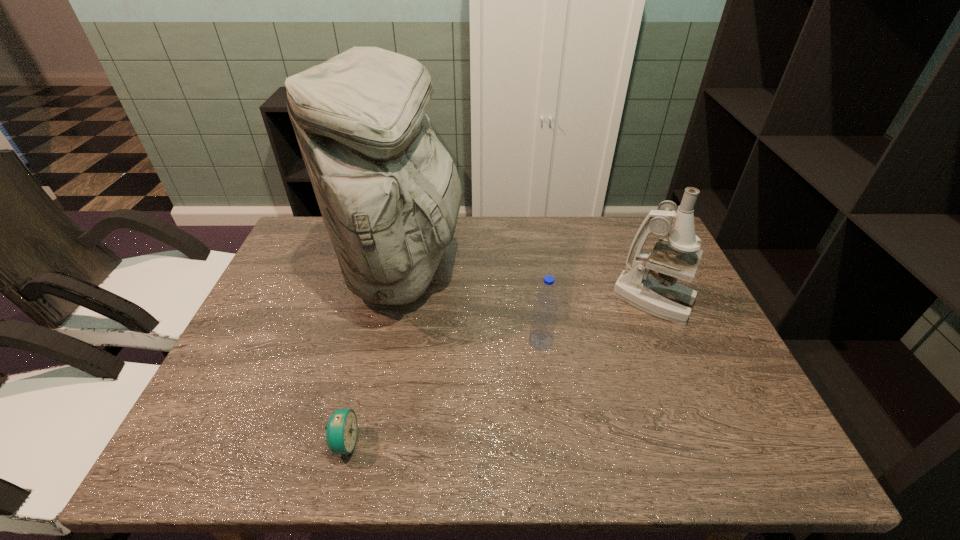
Find the location of a particular element. the second closest object to the backpack is located at coordinates (341, 431).

Where is `free spot that satisfies the following two spatial constraints: 1. on the front-facing side of the rightmost object; 2. on the left side of the tallest object`? This screenshot has width=960, height=540. free spot that satisfies the following two spatial constraints: 1. on the front-facing side of the rightmost object; 2. on the left side of the tallest object is located at coordinates (396, 301).

The width and height of the screenshot is (960, 540). I want to click on free spot that satisfies the following two spatial constraints: 1. on the front-facing side of the backpack; 2. on the left side of the second tallest object, so click(396, 301).

Identify the location of free spot that satisfies the following two spatial constraints: 1. on the front-facing side of the rightmost object; 2. on the right side of the backpack. (396, 301).

Find the location of a particular element. This screenshot has height=540, width=960. vacant point that satisfies the following two spatial constraints: 1. on the front-facing side of the tallest object; 2. on the left side of the third tallest object is located at coordinates (389, 342).

The height and width of the screenshot is (540, 960). Identify the location of vacant space that satisfies the following two spatial constraints: 1. on the front-facing side of the tallest object; 2. on the back side of the second tallest object. tap(396, 301).

Identify the location of free location that satisfies the following two spatial constraints: 1. on the front-facing side of the backpack; 2. on the back side of the rightmost object. (396, 301).

Identify the location of free space that satisfies the following two spatial constraints: 1. on the front-facing side of the rightmost object; 2. on the left side of the backpack. The width and height of the screenshot is (960, 540). (396, 301).